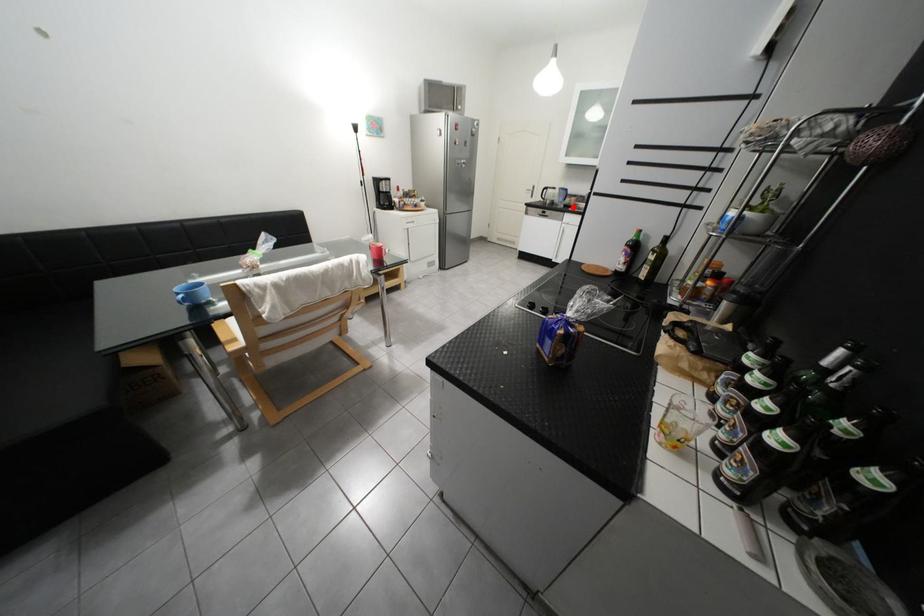
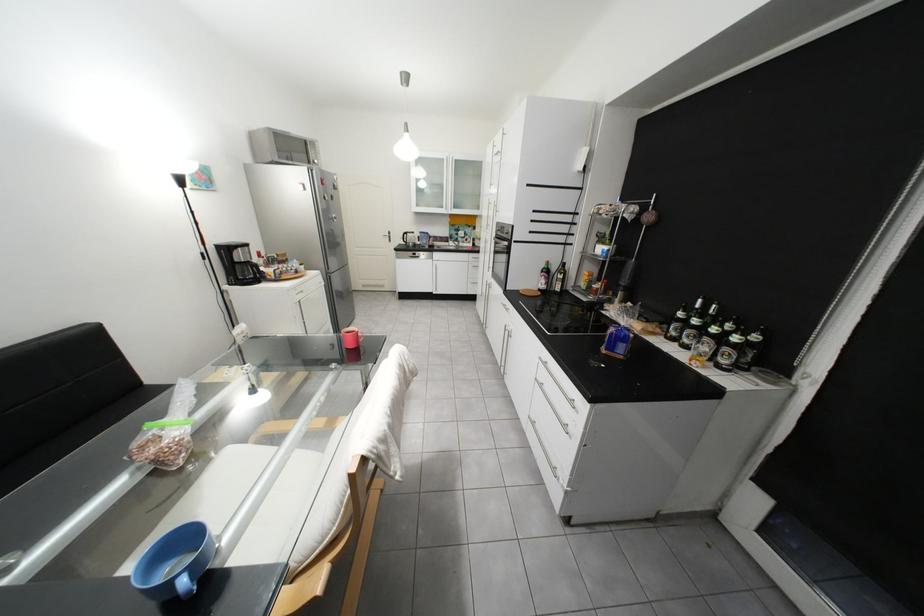
Where in the second image is the point corresponding to the highlighted location from the first image?

(439, 248)